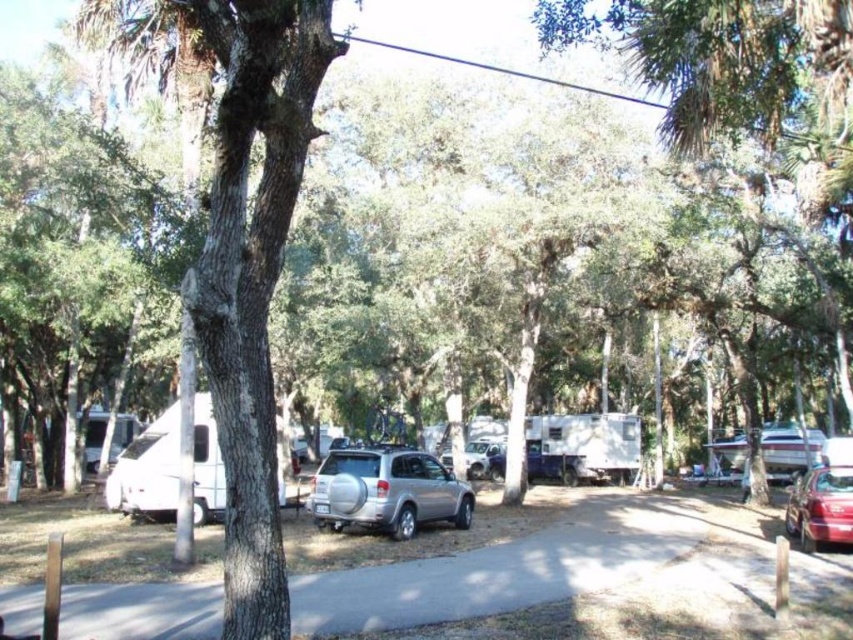
Question: From the image, what is the correct spatial relationship of smooth bark tree at left in relation to shiny red sedan at lower right?

Choices:
 (A) below
 (B) above

Answer: (B)

Question: Can you confirm if silver metallic suv at center is thinner than shiny red sedan at lower right?

Choices:
 (A) no
 (B) yes

Answer: (B)

Question: Among these points, which one is nearest to the camera?

Choices:
 (A) (407, 452)
 (B) (253, 397)
 (C) (129, 452)

Answer: (B)

Question: Which point is closer to the camera?

Choices:
 (A) (838, 540)
 (B) (231, 544)
 (C) (328, 529)

Answer: (B)

Question: Which is nearer to the shiny red sedan at lower right?

Choices:
 (A) white matte camper at left
 (B) satin silver suv at center
 (C) silver metallic suv at center
 (D) smooth bark tree at left

Answer: (C)

Question: Does silver metallic suv at center lie behind satin silver suv at center?

Choices:
 (A) yes
 (B) no

Answer: (B)